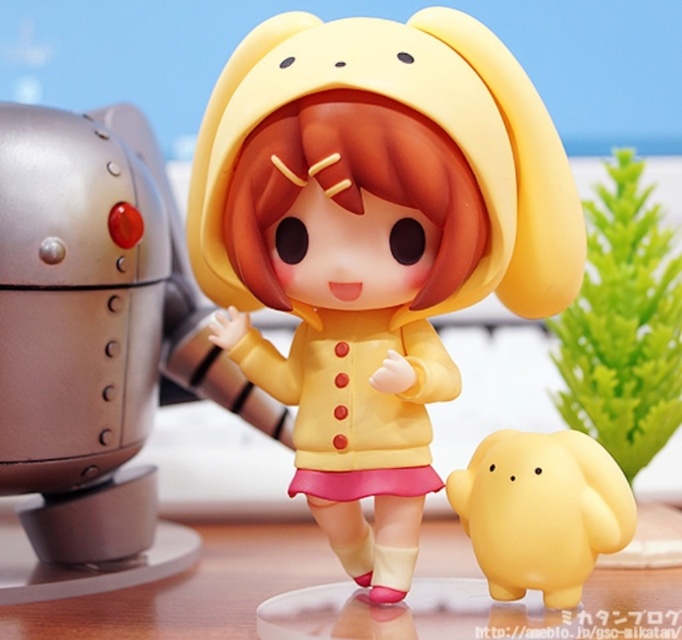
Between yellow matte doll at center and glossy plastic table at lower center, which one has more height?

yellow matte doll at center is taller.

Can you confirm if yellow matte doll at center is positioned below glossy plastic table at lower center?

No.

Does point (533, 304) come farther from viewer compared to point (196, 598)?

No, it is in front of (196, 598).

Find the location of a particular element. This screenshot has height=640, width=682. yellow matte doll at center is located at coordinates pos(374,237).

Does yellow matte doll at center appear on the right side of brushed metal robot at left?

Indeed, yellow matte doll at center is positioned on the right side of brushed metal robot at left.

Is yellow matte doll at center positioned at the back of brushed metal robot at left?

No, it is in front of brushed metal robot at left.

Which is in front, point (458, 186) or point (281, 429)?

Positioned in front is point (458, 186).

Where is `yellow matte doll at center`? yellow matte doll at center is located at coordinates (374, 237).

Looking at this image, can you confirm if brushed metal robot at left is thinner than yellow matte plush at center?

Incorrect, brushed metal robot at left's width is not less than yellow matte plush at center's.

The image size is (682, 640). What do you see at coordinates (95, 349) in the screenshot?
I see `brushed metal robot at left` at bounding box center [95, 349].

This screenshot has width=682, height=640. In order to click on brushed metal robot at left in this screenshot , I will do `click(95, 349)`.